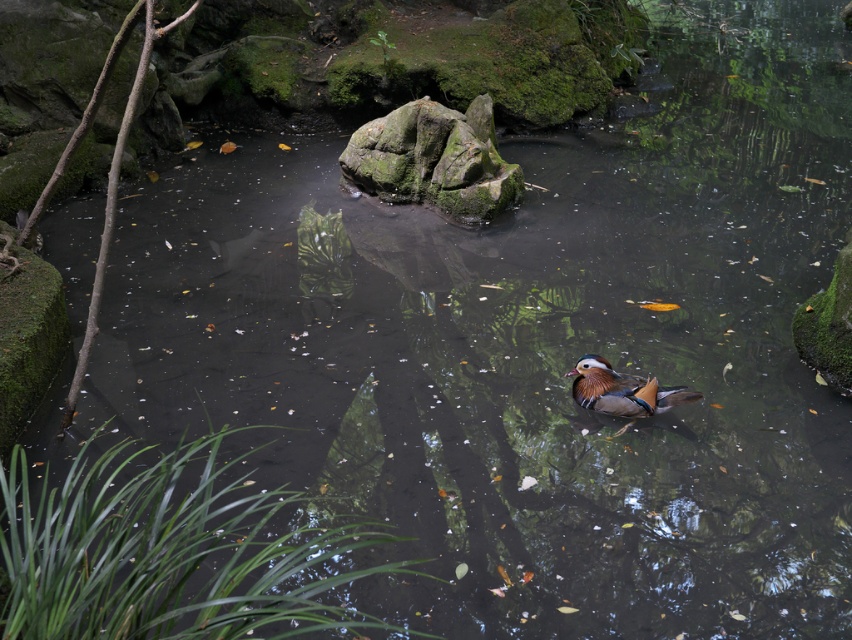
Question: Which object is closer to the camera taking this photo?

Choices:
 (A) green mossy rock at center
 (B) shiny orange duck at center

Answer: (B)

Question: Does green mossy rock at center come behind shiny orange duck at center?

Choices:
 (A) yes
 (B) no

Answer: (A)

Question: Considering the relative positions of green mossy rock at center and shiny orange duck at center in the image provided, where is green mossy rock at center located with respect to shiny orange duck at center?

Choices:
 (A) below
 (B) above

Answer: (B)

Question: Considering the relative positions of green mossy rock at center and shiny orange duck at center in the image provided, where is green mossy rock at center located with respect to shiny orange duck at center?

Choices:
 (A) left
 (B) right

Answer: (A)